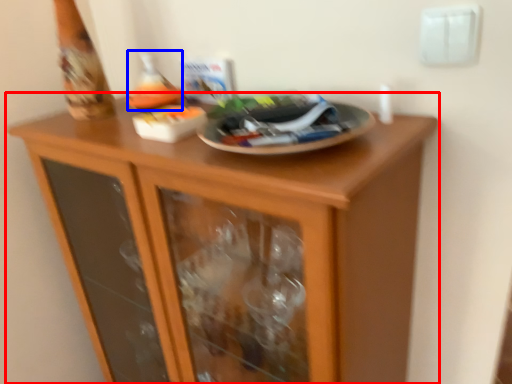
Question: Which of the following is the closest to the observer, cupboard (highlighted by a red box) or wine bottle (highlighted by a blue box)?

Choices:
 (A) cupboard
 (B) wine bottle

Answer: (A)